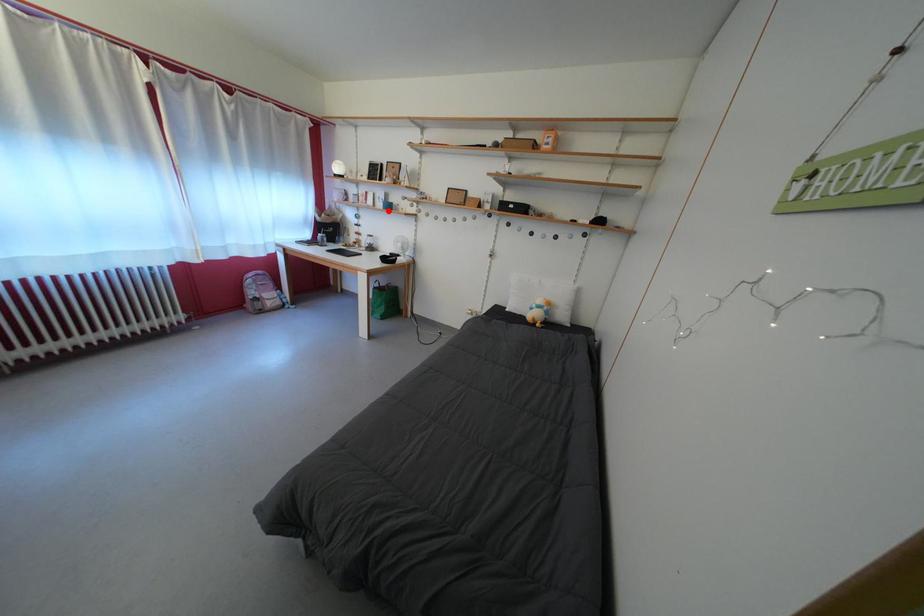
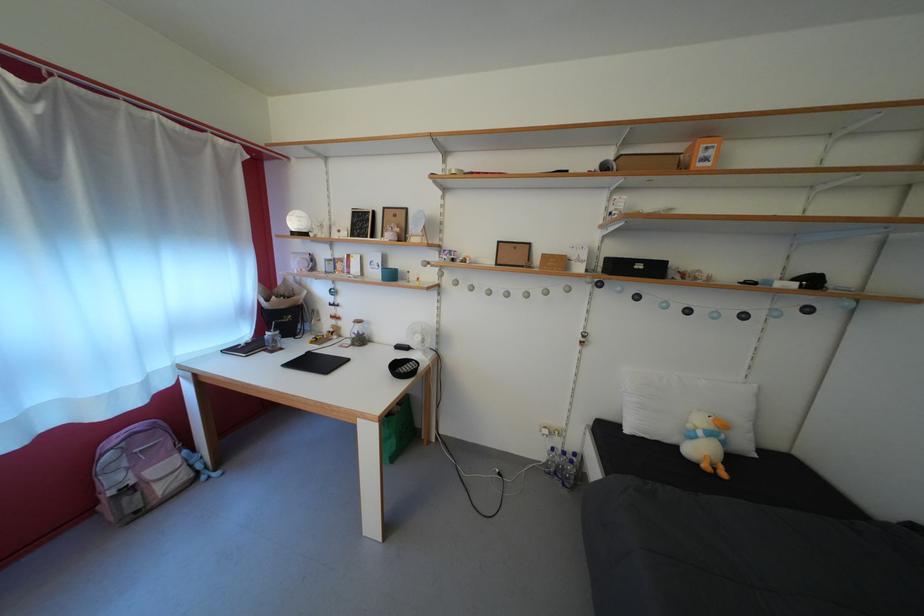
Locate, in the second image, the point that corresponds to the highlighted location in the first image.

(383, 280)